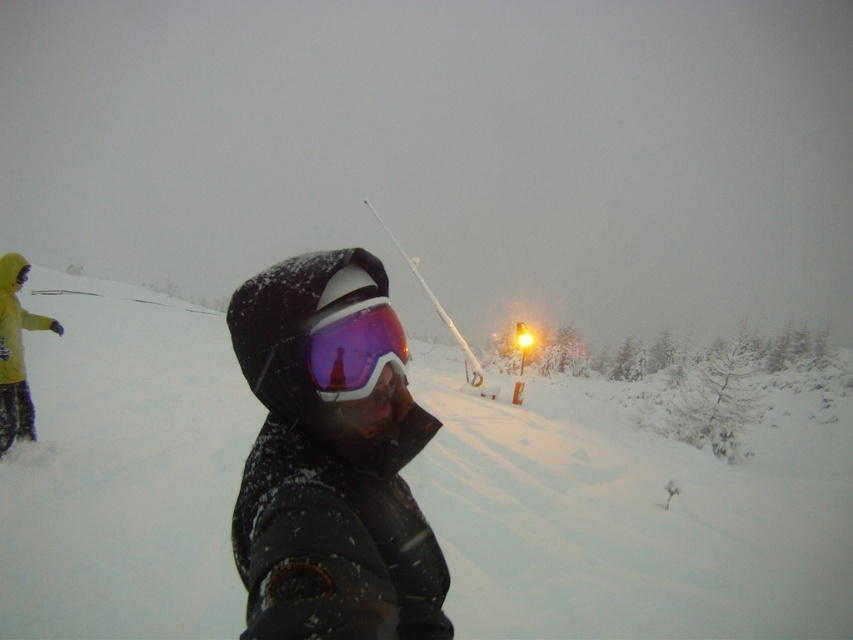
Image resolution: width=853 pixels, height=640 pixels. Describe the element at coordinates (331, 460) in the screenshot. I see `matte black jacket at center` at that location.

Who is more forward, (271, 460) or (337, 337)?

Point (337, 337)

Which is in front, point (364, 483) or point (397, 349)?

Positioned in front is point (364, 483).

This screenshot has width=853, height=640. I want to click on matte black jacket at center, so [331, 460].

Does matte black jacket at center come behind yellow fabric pants at left?

That is False.

Which is below, matte black jacket at center or yellow fabric pants at left?

yellow fabric pants at left is lower down.

I want to click on matte black jacket at center, so click(331, 460).

Is white fluffy snow at center below yellow fabric pants at left?

Indeed, white fluffy snow at center is positioned under yellow fabric pants at left.

Between point (463, 563) and point (22, 416), which one is positioned behind?

Positioned behind is point (22, 416).

Is point (515, 582) closer to camera compared to point (15, 381)?

That is True.

This screenshot has height=640, width=853. Identify the location of white fluffy snow at center. (631, 515).